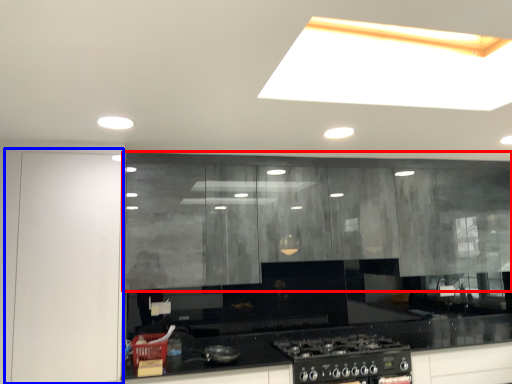
Question: Which object appears farthest to the camera in this image, cabinetry (highlighted by a red box) or glass door (highlighted by a blue box)?

Choices:
 (A) cabinetry
 (B) glass door

Answer: (A)